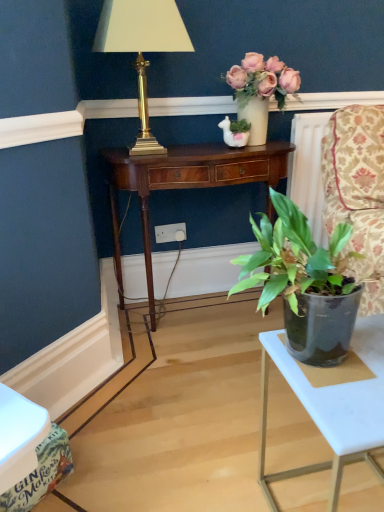
Describe the element at coordinates (142, 47) in the screenshot. The height and width of the screenshot is (512, 384). I see `gold metallic lamp at upper left` at that location.

This screenshot has width=384, height=512. What do you see at coordinates (332, 406) in the screenshot?
I see `white plastic table at lower right` at bounding box center [332, 406].

What is the approximate height of green glossy leafy plant at center, acting as the first houseplant starting from the top?

It is 35.81 centimeters.

The image size is (384, 512). I want to click on green glossy leafy plant at center, positioned as the first houseplant in back-to-front order, so click(260, 90).

Locate an element on the screen. white plastic power outlet at center is located at coordinates (170, 233).

Where is `gold metallic lamp at upper left`? gold metallic lamp at upper left is located at coordinates 142,47.

Based on the photo, between green glossy plant at center, which is the first houseplant from bottom to top, and gold metallic lamp at upper left, which one has larger size?

gold metallic lamp at upper left.

From a real-world perspective, does green glossy plant at center, which is the first houseplant from bottom to top, sit lower than gold metallic lamp at upper left?

Yes, from a real-world perspective, green glossy plant at center, which is the first houseplant from bottom to top, is beneath gold metallic lamp at upper left.

Is green glossy plant at center, acting as the first houseplant starting from the front, oriented towards gold metallic lamp at upper left?

No, green glossy plant at center, acting as the first houseplant starting from the front, is not aimed at gold metallic lamp at upper left.

From a real-world perspective, is green glossy leafy plant at center, the second houseplant ordered from the bottom, physically below gold metallic lamp at upper left?

Yes, from a real-world perspective, green glossy leafy plant at center, the second houseplant ordered from the bottom, is below gold metallic lamp at upper left.

Is green glossy leafy plant at center, positioned as the 2th houseplant in front-to-back order, smaller than gold metallic lamp at upper left?

Indeed, green glossy leafy plant at center, positioned as the 2th houseplant in front-to-back order, has a smaller size compared to gold metallic lamp at upper left.

Based on the photo, from the image's perspective, is green glossy leafy plant at center, positioned as the 2th houseplant in front-to-back order, on gold metallic lamp at upper left?

No.

Can you confirm if green glossy leafy plant at center, acting as the first houseplant starting from the top, is taller than gold metallic lamp at upper left?

Incorrect, the height of green glossy leafy plant at center, acting as the first houseplant starting from the top, is not larger of that of gold metallic lamp at upper left.

From a real-world perspective, is green glossy plant at center, acting as the first houseplant starting from the front, physically located above or below white plastic table at lower right?

green glossy plant at center, acting as the first houseplant starting from the front, is above white plastic table at lower right.

Considering the points (342, 247) and (288, 375), which point is behind, point (342, 247) or point (288, 375)?

The point (288, 375) is behind.

Can you tell me how much green glossy plant at center, acting as the second houseplant starting from the back, and white plastic table at lower right differ in facing direction?

0.572 degrees.

Does green glossy plant at center, which is the first houseplant from bottom to top, have a larger size compared to white plastic table at lower right?

Actually, green glossy plant at center, which is the first houseplant from bottom to top, might be smaller than white plastic table at lower right.

Is mahogany wood desk at center far away from white plastic table at lower right?

mahogany wood desk at center is near white plastic table at lower right, not far away.

Could you tell me if mahogany wood desk at center is facing white plastic table at lower right?

Yes, mahogany wood desk at center is facing white plastic table at lower right.

Relative to white plastic table at lower right, is mahogany wood desk at center in front or behind?

In the image, mahogany wood desk at center appears behind white plastic table at lower right.

From the image's perspective, is mahogany wood desk at center on top of white plastic table at lower right?

Yes.

Could you measure the distance between gold metallic lamp at upper left and green glossy leafy plant at center, positioned as the 2th houseplant in front-to-back order?

gold metallic lamp at upper left and green glossy leafy plant at center, positioned as the 2th houseplant in front-to-back order, are 14.62 inches apart from each other.

The image size is (384, 512). What are the coordinates of `houseplant that is the 1st one when counting downward from the gold metallic lamp at upper left (from the image's perspective)` in the screenshot? It's located at pyautogui.click(x=260, y=90).

From the image's perspective, which is below, gold metallic lamp at upper left or green glossy leafy plant at center, positioned as the first houseplant in back-to-front order?

green glossy leafy plant at center, positioned as the first houseplant in back-to-front order, appears lower in the image.

Could you tell me if mahogany wood desk at center is turned towards gold metallic lamp at upper left?

No, mahogany wood desk at center does not turn towards gold metallic lamp at upper left.

Based on the photo, can gold metallic lamp at upper left be found inside mahogany wood desk at center?

No, gold metallic lamp at upper left is not inside mahogany wood desk at center.

Is the surface of mahogany wood desk at center in direct contact with gold metallic lamp at upper left?

No, mahogany wood desk at center is not next to gold metallic lamp at upper left.

In the scene shown: Which object is closer to the camera, white plastic table at lower right or white plastic power outlet at center?

white plastic table at lower right is more forward.

Consider the image. In the image, is white plastic table at lower right on the left side or the right side of white plastic power outlet at center?

white plastic table at lower right is to the right of white plastic power outlet at center.

Which is behind, point (347, 405) or point (161, 240)?

The point (161, 240) is farther.

Is white plastic table at lower right not inside white plastic power outlet at center?

Yes.

Find the location of a particular element. houseplant in front of the gold metallic lamp at upper left is located at coordinates (304, 283).

You are a GUI agent. You are given a task and a screenshot of the screen. Output one action in this format:
    pyautogui.click(x=<x>, y=<y>)
    Task: Click on the lamp above the green glossy leafy plant at center, positioned as the 2th houseplant in front-to-back order (from the image's perspective)
    
    Given the screenshot: What is the action you would take?
    point(142,47)

Looking at the image, which one is located closer to green glossy leafy plant at center, positioned as the first houseplant in back-to-front order, white plastic power outlet at center or mahogany wood desk at center?

Among the two, mahogany wood desk at center is located nearer to green glossy leafy plant at center, positioned as the first houseplant in back-to-front order.

Estimate the real-world distances between objects in this image. Which object is closer to mahogany wood desk at center, green glossy leafy plant at center, positioned as the 2th houseplant in front-to-back order, or gold metallic lamp at upper left?

Among the two, green glossy leafy plant at center, positioned as the 2th houseplant in front-to-back order, is located nearer to mahogany wood desk at center.

Looking at the image, which one is located closer to gold metallic lamp at upper left, mahogany wood desk at center or white plastic table at lower right?

The object closer to gold metallic lamp at upper left is mahogany wood desk at center.

Looking at the image, which one is located closer to white plastic table at lower right, mahogany wood desk at center or white plastic power outlet at center?

Among the two, mahogany wood desk at center is located nearer to white plastic table at lower right.

When comparing their distances from white plastic power outlet at center, does green glossy leafy plant at center, acting as the first houseplant starting from the top, or green glossy plant at center, which is the first houseplant from bottom to top, seem further?

Based on the image, green glossy plant at center, which is the first houseplant from bottom to top, appears to be further to white plastic power outlet at center.

Estimate the real-world distances between objects in this image. Which object is closer to white plastic table at lower right, green glossy leafy plant at center, positioned as the 2th houseplant in front-to-back order, or green glossy plant at center, acting as the second houseplant starting from the back?

The object closer to white plastic table at lower right is green glossy plant at center, acting as the second houseplant starting from the back.

Which object lies further to the anchor point mahogany wood desk at center, gold metallic lamp at upper left or white plastic power outlet at center?

white plastic power outlet at center.

Based on their spatial positions, is mahogany wood desk at center or green glossy leafy plant at center, the second houseplant ordered from the bottom, further from white plastic power outlet at center?

The object further to white plastic power outlet at center is green glossy leafy plant at center, the second houseplant ordered from the bottom.

What are the coordinates of `desk between green glossy plant at center, acting as the first houseplant starting from the front, and white plastic power outlet at center, along the z-axis` in the screenshot? It's located at (185, 184).

Locate an element on the screen. desk that lies between gold metallic lamp at upper left and white plastic table at lower right from top to bottom is located at coordinates (185, 184).

Find the location of a particular element. This screenshot has width=384, height=512. houseplant that lies between green glossy leafy plant at center, positioned as the 2th houseplant in front-to-back order, and white plastic table at lower right from top to bottom is located at coordinates (304, 283).

Identify the location of desk between white plastic table at lower right and white plastic power outlet at center along the z-axis. The image size is (384, 512). (185, 184).